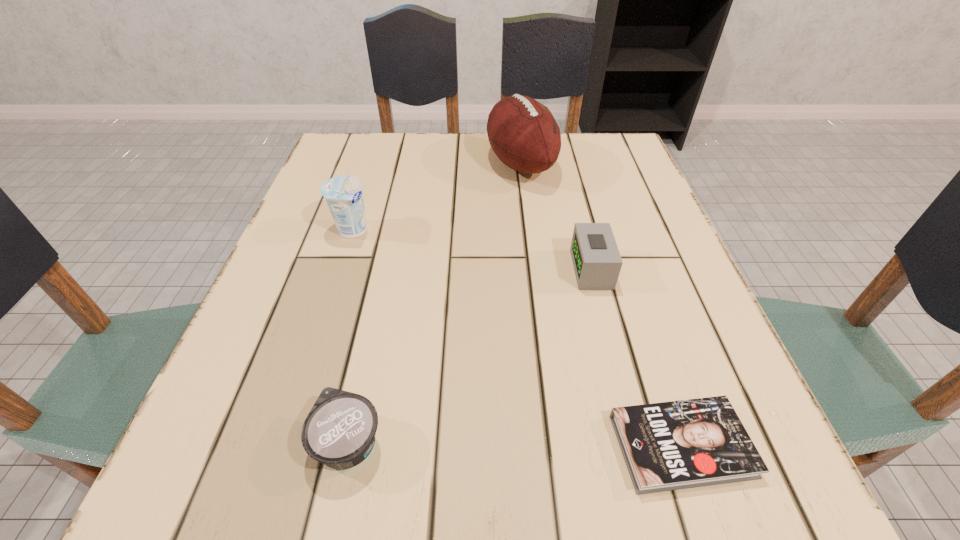
Locate an element on the screen. The height and width of the screenshot is (540, 960). vacant point located between the taller yogurt and the third tallest object is located at coordinates coord(472,249).

Locate an element on the screen. free point between the shortest object and the fourth tallest object is located at coordinates (516, 444).

Image resolution: width=960 pixels, height=540 pixels. Identify the location of vacant space that's between the second tallest object and the tallest object. (437, 197).

You are a GUI agent. You are given a task and a screenshot of the screen. Output one action in this format:
    pyautogui.click(x=<x>, y=<y>)
    Task: Click on the vacant area that lies between the second tallest object and the nearer yogurt
    The height and width of the screenshot is (540, 960).
    Given the screenshot: What is the action you would take?
    pyautogui.click(x=351, y=336)

Where is `vacant space that's between the shortest object and the football (American)`? Image resolution: width=960 pixels, height=540 pixels. vacant space that's between the shortest object and the football (American) is located at coordinates (601, 305).

Where is `free point between the shortest object and the fourth tallest object`? The height and width of the screenshot is (540, 960). free point between the shortest object and the fourth tallest object is located at coordinates (516, 444).

This screenshot has width=960, height=540. I want to click on unoccupied position between the farthest object and the second tallest object, so click(x=437, y=197).

This screenshot has height=540, width=960. I want to click on free space between the nearer yogurt and the third shortest object, so click(x=470, y=356).

At what (x,y) coordinates should I click in order to perform the action: click on object that is the second closest to the third shortest object. Please return your answer as a coordinate pair (x, y). This screenshot has width=960, height=540. Looking at the image, I should click on (674, 445).

You are a GUI agent. You are given a task and a screenshot of the screen. Output one action in this format:
    pyautogui.click(x=<x>, y=<y>)
    Task: Click on the object that is the closest one to the shortest object
    
    Given the screenshot: What is the action you would take?
    pyautogui.click(x=596, y=259)